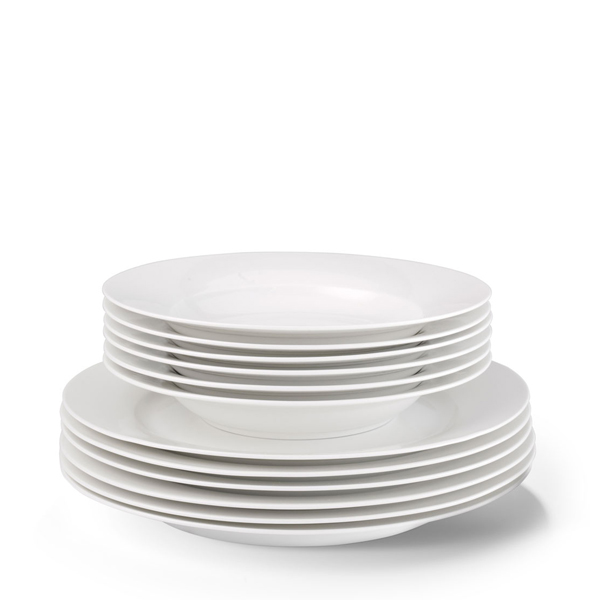
This screenshot has width=600, height=600. What are the coordinates of `bowls` in the screenshot? It's located at (288, 332), (288, 349), (288, 361), (286, 375), (285, 389), (285, 405).